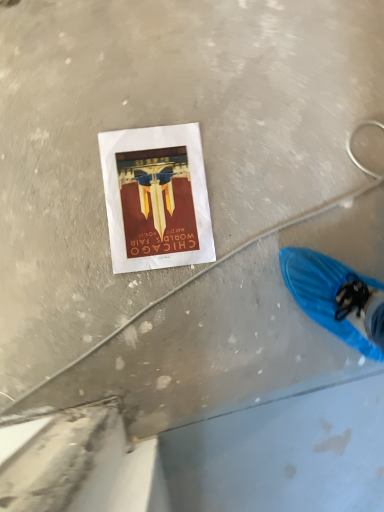
The height and width of the screenshot is (512, 384). What are the coordinates of `vacant area that is situated to the right of matte paper poster at center` in the screenshot? It's located at (258, 220).